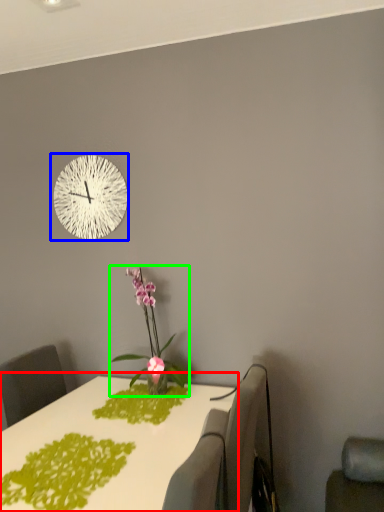
Question: Considering the real-world distances, which object is closest to table (highlighted by a red box)? wall clock (highlighted by a blue box) or houseplant (highlighted by a green box).

Choices:
 (A) wall clock
 (B) houseplant

Answer: (B)